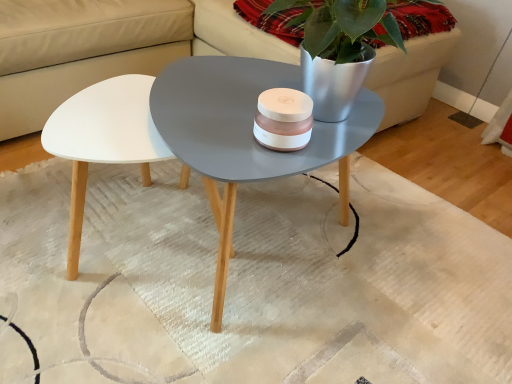
Question: Which is correct: metallic silver pot at upper right is inside white leather couch at upper center, or outside of it?

Choices:
 (A) inside
 (B) outside

Answer: (A)

Question: In terms of size, does metallic silver pot at upper right appear bigger or smaller than white leather couch at upper center?

Choices:
 (A) small
 (B) big

Answer: (A)

Question: Considering the real-world distances, which object is closest to the metallic silver pot at upper right?

Choices:
 (A) white leather couch at upper center
 (B) white textured rug at center

Answer: (B)

Question: Estimate the real-world distances between objects in this image. Which object is farther from the metallic silver pot at upper right?

Choices:
 (A) white textured rug at center
 (B) white leather couch at upper center

Answer: (B)